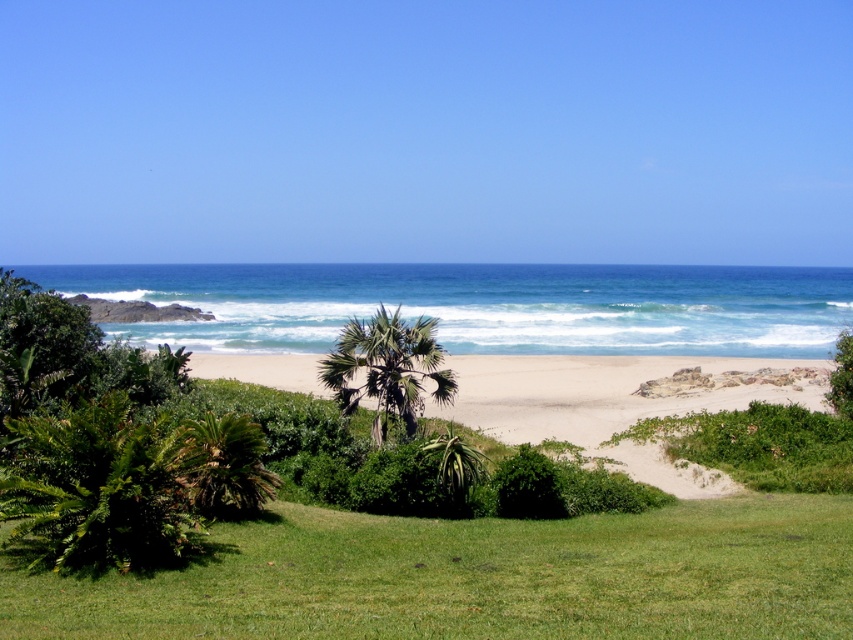
You are standing on the green leafy palm tree at lower left and want to walk straight towards the beige sand at center. In which direction should you go?

The beige sand at center is to the right of green leafy palm tree at lower left, so you should walk to the right to reach it.

You are standing on the beach and want to find the tallest palm tree between the green leafy palm tree at center and the green leafy palm tree at lower left. Which one should you look towards?

The green leafy palm tree at center is much taller than the green leafy palm tree at lower left, so you should look towards the center to find the tallest one.

You are standing on the beige sand at center and want to reach the green leafy palm tree at center. In which direction should you walk to get there?

To reach the green leafy palm tree at center from the beige sand at center, you should walk to the left since the beige sand at center is located to the right of the palm tree.